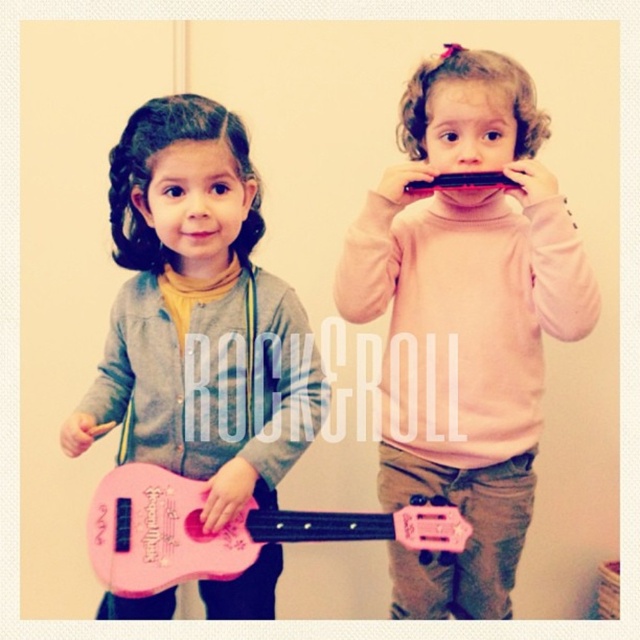
You have two guitars in front of you, a pink plastic guitar at left and a pink matte guitar at center. Which one is wider?

The pink matte guitar at center is wider than the pink plastic guitar at left.

You are a toy collector who wants to display both the pink plastic guitar at left and the pink matte guitar at center on a shelf. Based on their sizes, which guitar should be placed at the back to avoid blocking the view of the other?

The pink plastic guitar at left is much taller than the pink matte guitar at center, so placing the taller pink plastic guitar at left at the back would prevent it from blocking the view of the shorter pink matte guitar at center.

You are a photographer trying to capture a group photo of the two children. The pink plastic guitar at center and the pink plastic guitar at left are both in the frame. How far apart are the two pink plastic guitars in the image?

The pink plastic guitar at center is 13.21 inches from the pink plastic guitar at left, so the distance between them is 13.21 inches.